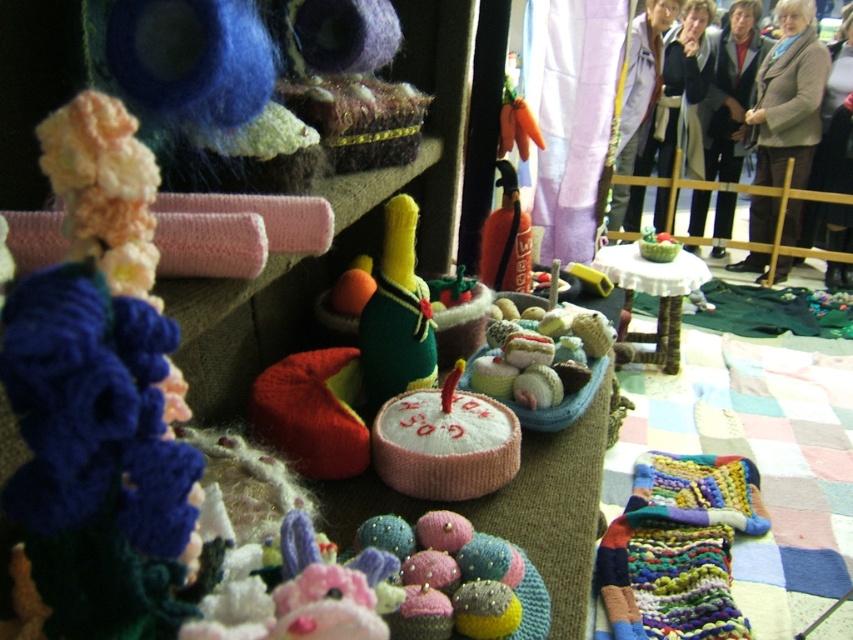
In the scene shown: You are a customer at the craft fair and want to place a small gift box between the green felt toy at center and the knitted cupcake display. Can you fit the box if it measures 0.5 meters in length?

The distance between the green felt toy at center and the knitted cupcake display is 1.03 meters. Since the gift box is 0.5 meters long, there is enough space to place it between them.